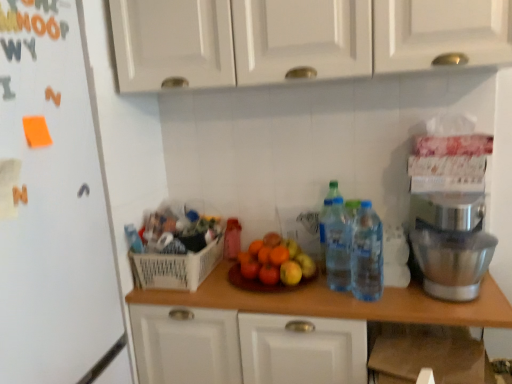
Identify the location of blank space to the left of translucent plastic bottles at center, which appears as the 1th bottle when viewed from the front. (303, 296).